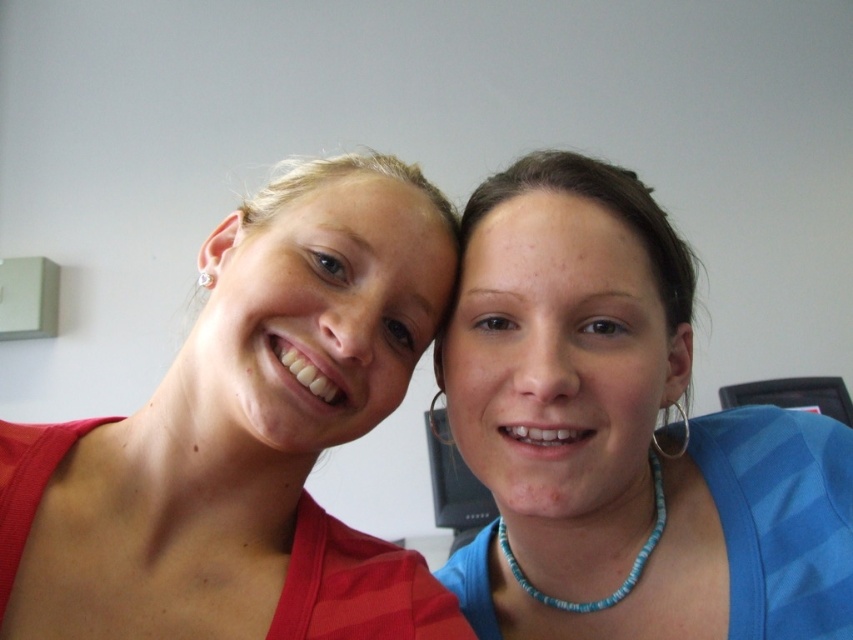
Consider the image. You are a photographer setting up for a group photo. You want to ensure that both the red striped dress at left and the blue beaded necklace at lower center are clearly visible in the shot. Considering their sizes, which object might require closer attention to ensure it doesn not get lost in the composition?

The blue beaded necklace at lower center might require closer attention because it is smaller than the red striped dress at left and could be less noticeable in the composition.

Looking at this image, you are a photographer setting up a shot of two people. You need to ensure that the matte red shirt at left and the blue beaded necklace at lower center are both visible in the frame. Given their heights, which object should you focus on first to ensure both are in the frame?

The matte red shirt at left is taller than the blue beaded necklace at lower center. To ensure both are visible, focus on the taller object first, which is the matte red shirt at left, then adjust the frame to include the shorter blue beaded necklace at lower center.

You are a photographer adjusting the camera focus. The red striped dress at left and the blue beaded necklace at lower center are both in the frame. Can you focus on both objects simultaneously if your camera has a depth of field that can cover 8 inches?

The distance between the red striped dress at left and the blue beaded necklace at lower center is 7.17 inches. Since the depth of field can cover 8 inches, which is greater than the distance between them, the camera can focus on both objects simultaneously.